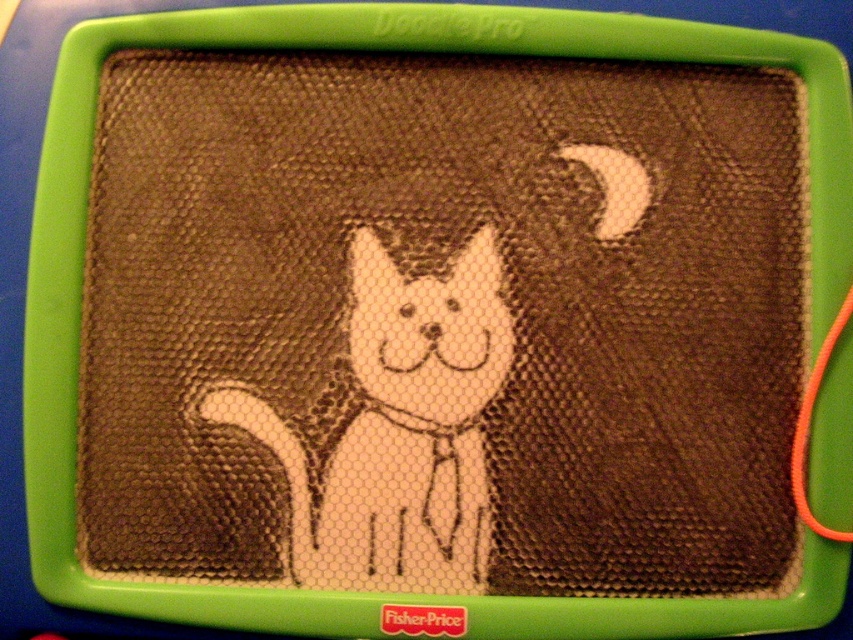
Can you confirm if brown textured screen at center is taller than white paper cat at center?

Yes.

Which is behind, point (437, 84) or point (387, 560)?

Positioned behind is point (437, 84).

Is point (189, 81) positioned behind point (218, 396)?

Yes, point (189, 81) is farther from viewer.

I want to click on brown textured screen at center, so (442, 323).